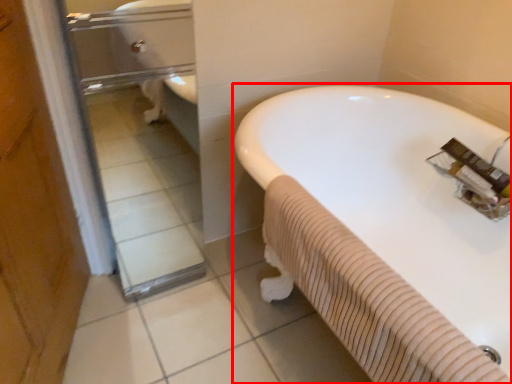
Question: In this image, where is bathtub (annotated by the red box) located relative to glass door?

Choices:
 (A) left
 (B) right

Answer: (B)